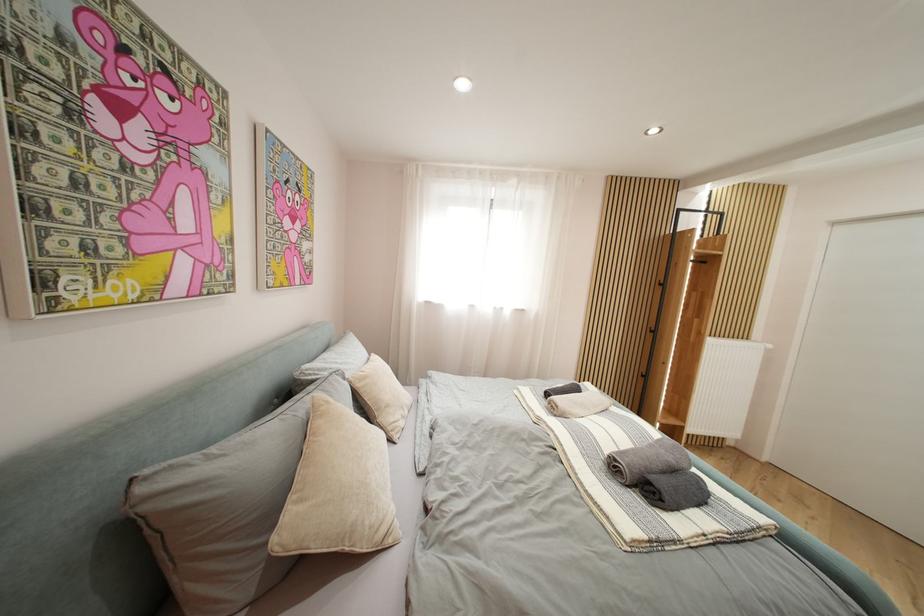
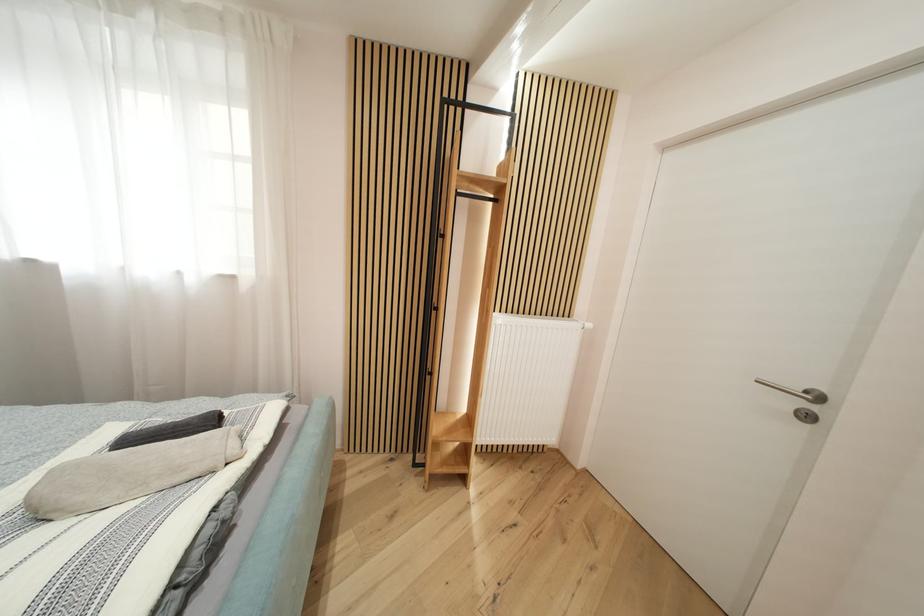
In a continuous first-person perspective shot, in which direction is the camera moving?

The cameraman moved toward right, forward.